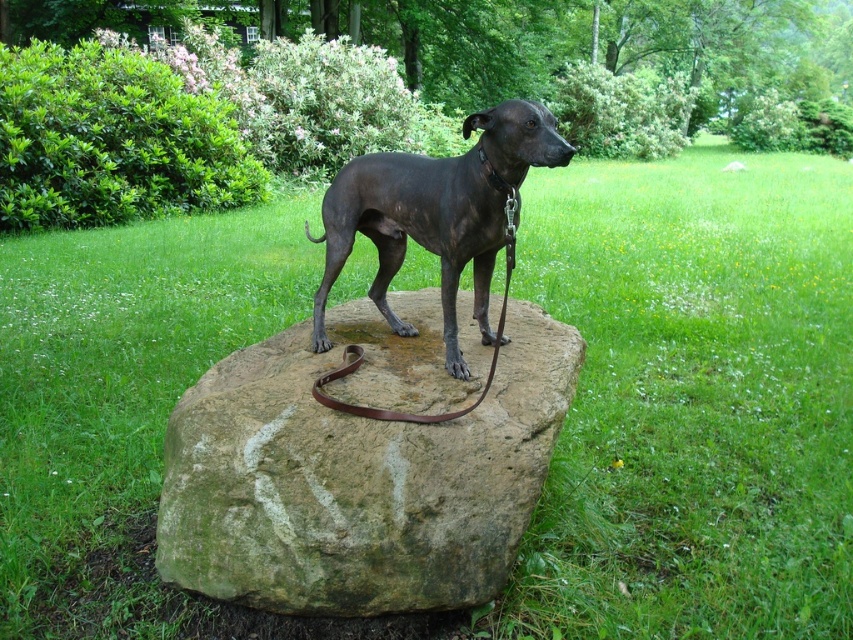
Is shiny black dog at center wider than brown leather leash at center?

Correct, the width of shiny black dog at center exceeds that of brown leather leash at center.

At what (x,y) coordinates should I click in order to perform the action: click on shiny black dog at center. Please return your answer as a coordinate pair (x, y). Looking at the image, I should click on (436, 212).

Is point (189, 524) closer to viewer compared to point (508, 209)?

No, (189, 524) is further to viewer.

Who is positioned more to the right, green mossy rock at center or brown leather leash at center?

brown leather leash at center

Measure the distance between green mossy rock at center and camera.

A distance of 2.62 meters exists between green mossy rock at center and camera.

The image size is (853, 640). Identify the location of green mossy rock at center. (363, 465).

Can you confirm if green mossy rock at center is wider than shiny black dog at center?

Yes, green mossy rock at center is wider than shiny black dog at center.

Is green mossy rock at center shorter than shiny black dog at center?

No, green mossy rock at center is not shorter than shiny black dog at center.

Does point (209, 472) come in front of point (505, 196)?

That is False.

Locate an element on the screen. This screenshot has height=640, width=853. green mossy rock at center is located at coordinates (363, 465).